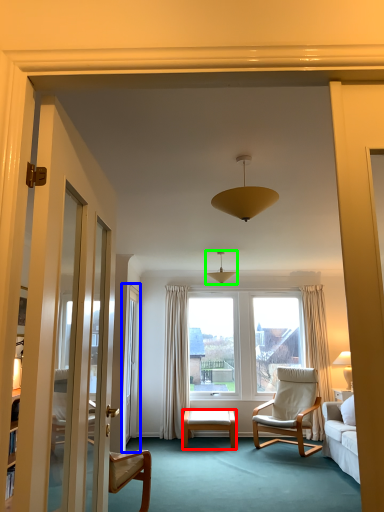
Question: Which object is positioned farthest from desk (highlighted by a red box)? Select from screen door (highlighted by a blue box) and light fixture (highlighted by a green box).

Choices:
 (A) screen door
 (B) light fixture

Answer: (B)